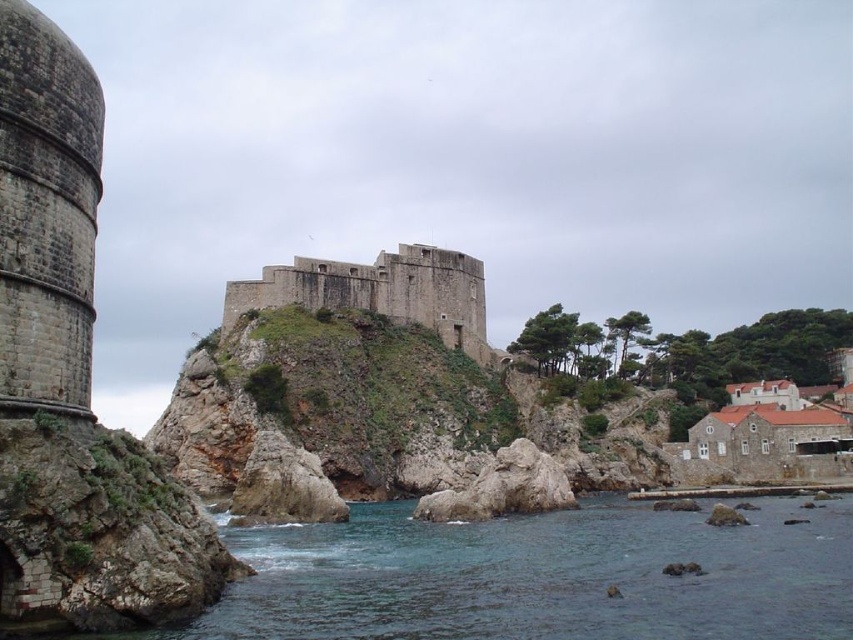
Question: Which object appears closest to the camera in this image?

Choices:
 (A) clear blue water at lower center
 (B) brown stone castle at center

Answer: (A)

Question: Can you confirm if clear blue water at lower center is bigger than brown stone castle at center?

Choices:
 (A) yes
 (B) no

Answer: (B)

Question: Is clear blue water at lower center to the left of brown stone castle at center from the viewer's perspective?

Choices:
 (A) yes
 (B) no

Answer: (B)

Question: Is clear blue water at lower center wider than brown stone castle at center?

Choices:
 (A) yes
 (B) no

Answer: (A)

Question: Which point is closer to the camera?

Choices:
 (A) brown stone castle at center
 (B) clear blue water at lower center

Answer: (B)